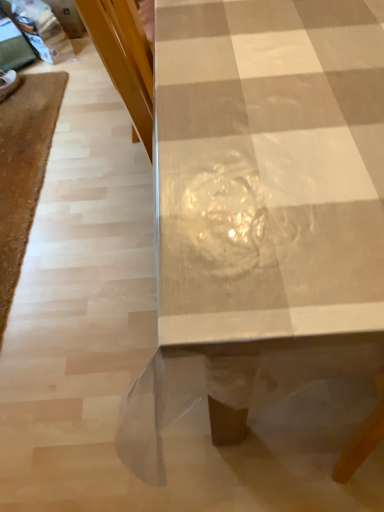
Locate an element on the screen. transparent plastic table at center is located at coordinates (261, 209).

In order to face transparent plastic table at center, should I rotate leftwards or rightwards?

To align with it, rotate right about 19.153°.

Describe the element at coordinates (261, 209) in the screenshot. I see `transparent plastic table at center` at that location.

The width and height of the screenshot is (384, 512). I want to click on transparent plastic table at center, so (x=261, y=209).